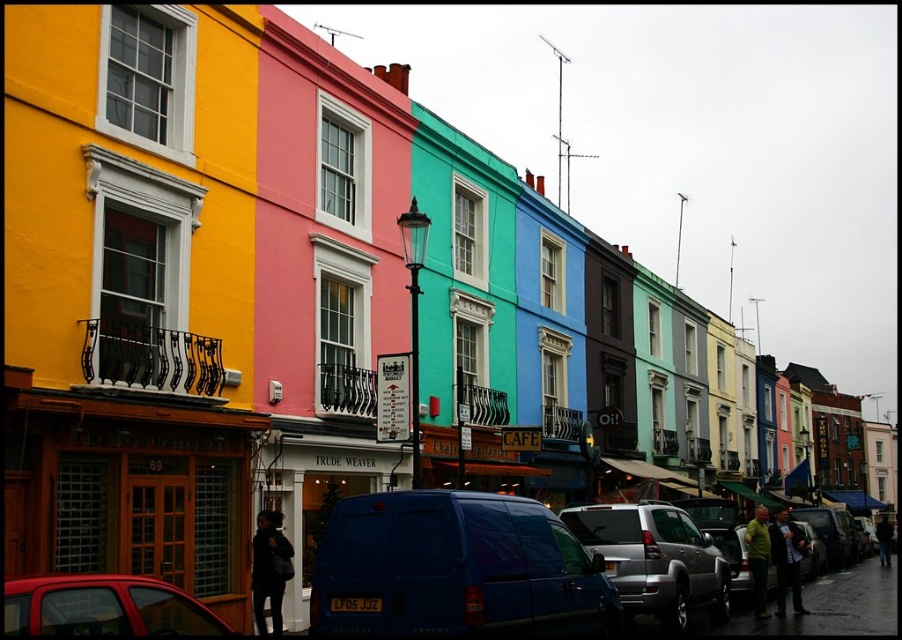
Question: Can you confirm if metallic silver suv at center is bigger than metallic red car at lower left?

Choices:
 (A) no
 (B) yes

Answer: (B)

Question: Estimate the real-world distances between objects in this image. Which object is closer to the metallic red car at lower left?

Choices:
 (A) blue matte van at center
 (B) metallic silver suv at center

Answer: (A)

Question: Which object is farther from the camera taking this photo?

Choices:
 (A) metallic silver suv at center
 (B) metallic red car at lower left
 (C) blue matte van at center

Answer: (A)

Question: Is blue matte van at center above metallic silver suv at center?

Choices:
 (A) yes
 (B) no

Answer: (A)

Question: Does metallic silver suv at center come in front of metallic red car at lower left?

Choices:
 (A) yes
 (B) no

Answer: (B)

Question: Which of the following is the farthest from the observer?

Choices:
 (A) (557, 632)
 (B) (658, 560)
 (C) (145, 595)

Answer: (B)